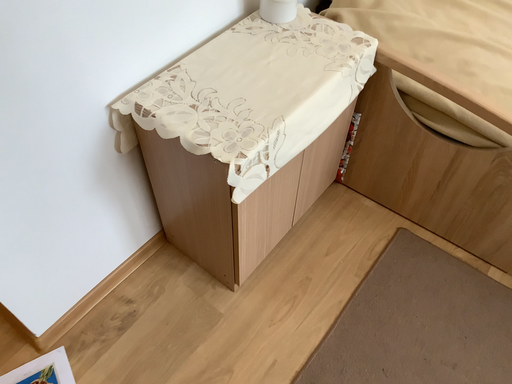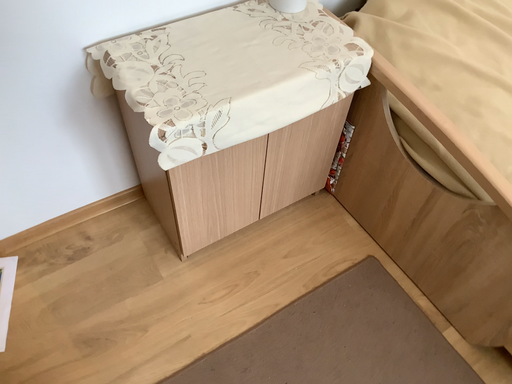
Question: Which way did the camera rotate in the video?

Choices:
 (A) rotated right
 (B) rotated left

Answer: (B)